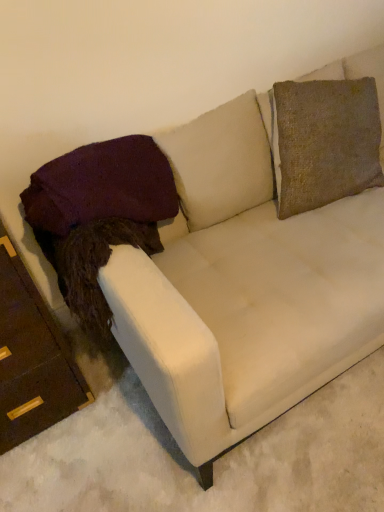
What do you see at coordinates (32, 358) in the screenshot? I see `dark wood dresser at lower left` at bounding box center [32, 358].

Find the location of a particular element. This screenshot has width=384, height=512. dark wood dresser at lower left is located at coordinates (32, 358).

Where is `dark wood dresser at lower left`? dark wood dresser at lower left is located at coordinates (32, 358).